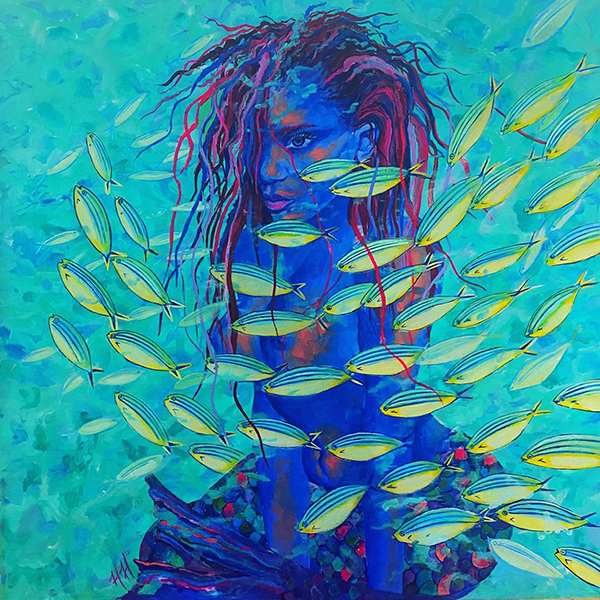
Locate an element on the screen. pink light reflections is located at coordinates (315, 151), (287, 117), (301, 346), (233, 340).